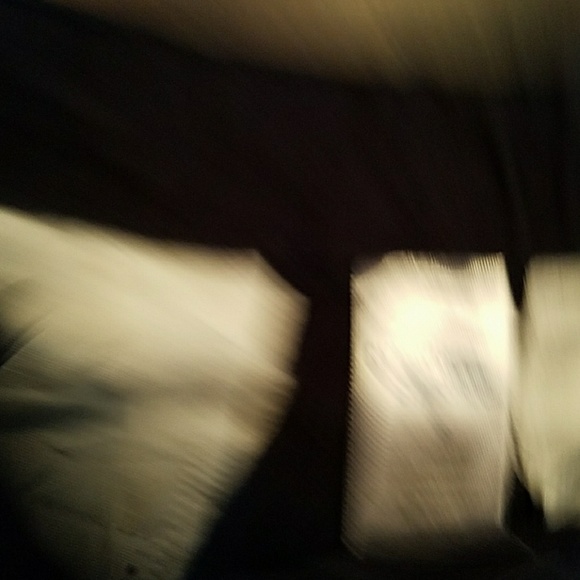
Identify the location of corner. The height and width of the screenshot is (580, 580). (543, 574), (18, 560), (13, 9), (568, 10).